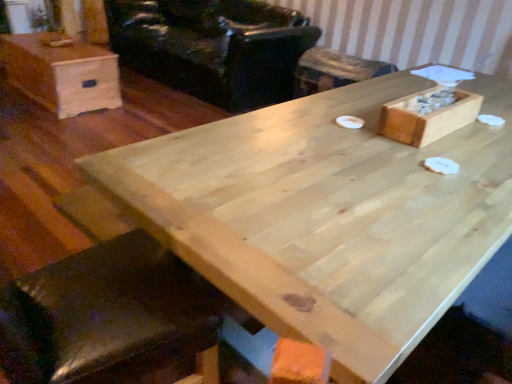
Question: From the image's perspective, would you say black leather armchair at upper center is shown under natural wood table at center?

Choices:
 (A) yes
 (B) no

Answer: (B)

Question: Is black leather armchair at upper center to the right of natural wood table at center from the viewer's perspective?

Choices:
 (A) yes
 (B) no

Answer: (B)

Question: From a real-world perspective, is black leather armchair at upper center below natural wood table at center?

Choices:
 (A) yes
 (B) no

Answer: (B)

Question: Is black leather armchair at upper center not within natural wood table at center?

Choices:
 (A) yes
 (B) no

Answer: (A)

Question: Can you confirm if black leather armchair at upper center is positioned to the left of natural wood table at center?

Choices:
 (A) no
 (B) yes

Answer: (B)

Question: Relative to wooden bar stool at center, is light brown wood box at upper left in front or behind?

Choices:
 (A) front
 (B) behind

Answer: (A)

Question: From a real-world perspective, is light brown wood box at upper left physically located above or below wooden bar stool at center?

Choices:
 (A) below
 (B) above

Answer: (A)

Question: Is light brown wood box at upper left to the left or to the right of wooden bar stool at center in the image?

Choices:
 (A) right
 (B) left

Answer: (B)

Question: Is light brown wood box at upper left wider or thinner than wooden bar stool at center?

Choices:
 (A) wide
 (B) thin

Answer: (A)

Question: In the image, is wooden bar stool at center on the left side or the right side of light brown wood box at upper left?

Choices:
 (A) left
 (B) right

Answer: (B)

Question: Is point (302, 86) closer or farther from the camera than point (90, 61)?

Choices:
 (A) closer
 (B) farther

Answer: (B)

Question: In terms of width, does wooden bar stool at center look wider or thinner when compared to light brown wood box at upper left?

Choices:
 (A) wide
 (B) thin

Answer: (B)

Question: From the image's perspective, is wooden bar stool at center above or below light brown wood box at upper left?

Choices:
 (A) below
 (B) above

Answer: (A)

Question: From the image's perspective, relative to natural wood table at center, is black leather armchair at upper center above or below?

Choices:
 (A) above
 (B) below

Answer: (A)

Question: Relative to natural wood table at center, is black leather armchair at upper center in front or behind?

Choices:
 (A) behind
 (B) front

Answer: (A)